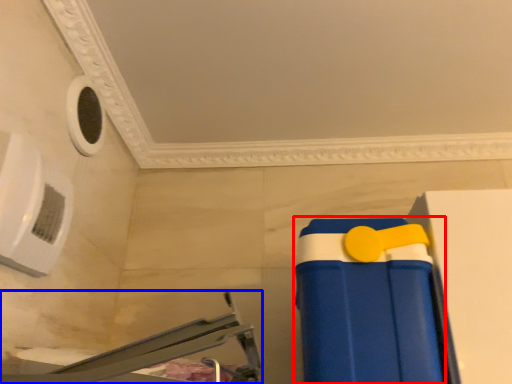
Question: Which of the following is the farthest to the observer, toy (highlighted by a red box) or furniture (highlighted by a blue box)?

Choices:
 (A) toy
 (B) furniture

Answer: (A)